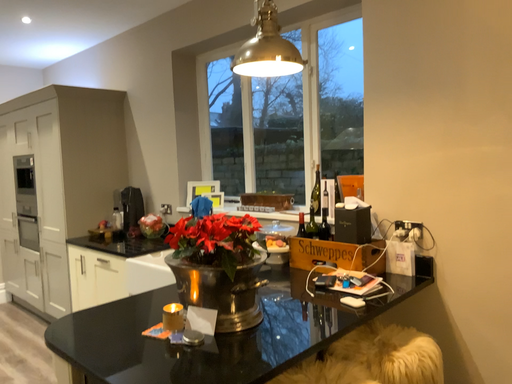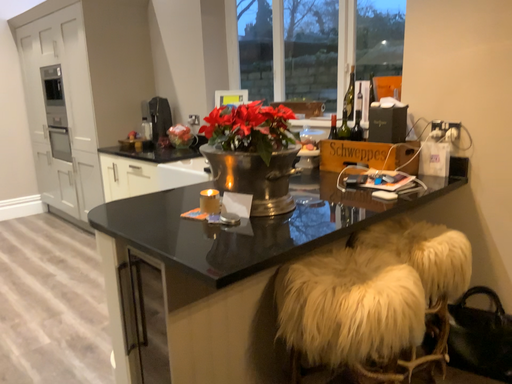
Question: How did the camera likely rotate when shooting the video?

Choices:
 (A) rotated upward
 (B) rotated downward

Answer: (B)